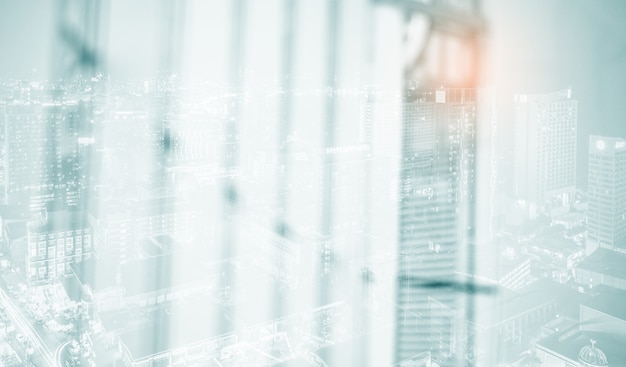
Where is `window blinds on reflection`? window blinds on reflection is located at coordinates (138, 202), (193, 206), (255, 207), (308, 197), (342, 196), (387, 199).